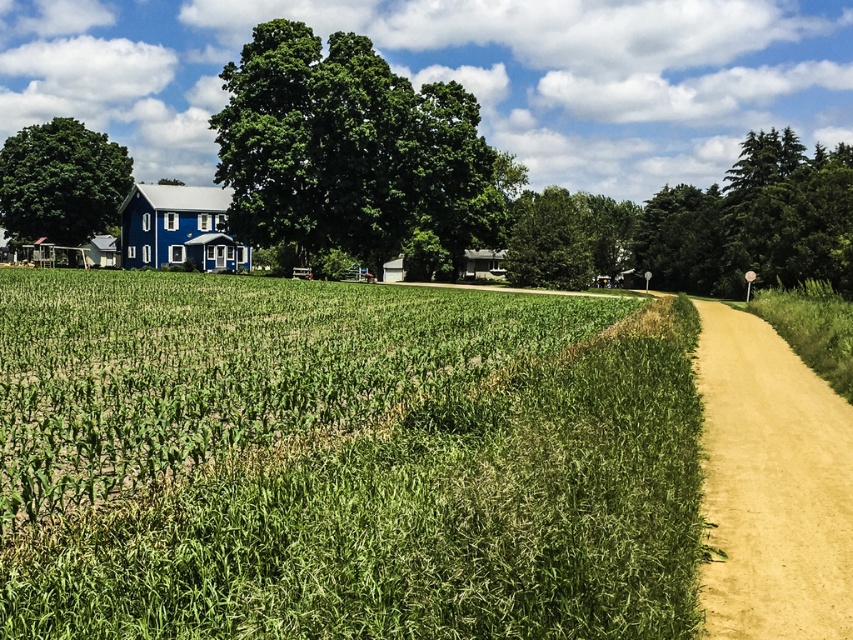
You are a hiker walking along the dirt road at right and want to reach the green leafy tree at upper center. Which direction should you turn to head towards the tree?

The green leafy tree at upper center is positioned on the left side of the dirt road at right, so you should turn left to head towards the tree.

Consider the image. You are a hiker trying to decide which path to take next. You see the green leafy tree at upper center and the dirt road at right. Which one is wider?

The green leafy tree at upper center is wider than the dirt road at right according to the description.

You are standing at the point marked as point (x=178, y=227) in the image. What object is located exactly at that point?

The blue wooden barn at center is located exactly at point (x=178, y=227).